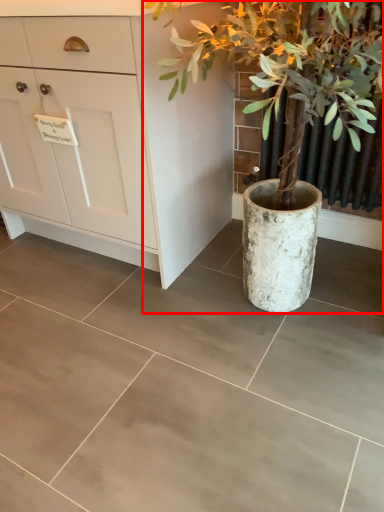
Question: From the image's perspective, where is houseplant (annotated by the red box) located in relation to chest of drawers in the image?

Choices:
 (A) above
 (B) below

Answer: (B)